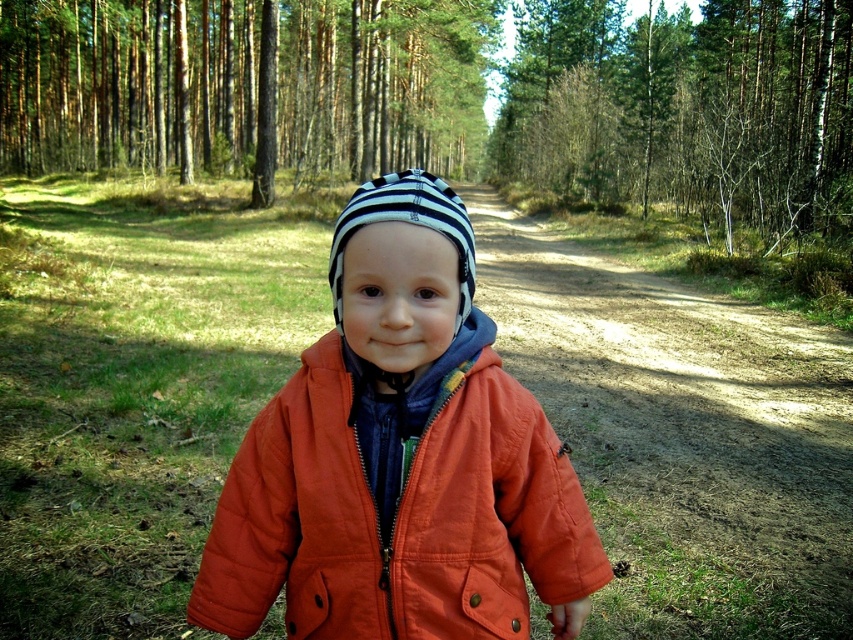
Question: Which point is closer to the camera taking this photo?

Choices:
 (A) (398, 356)
 (B) (550, 92)
 (C) (248, 132)

Answer: (A)

Question: Can you confirm if orange quilted jacket at center is positioned above smooth brown tree trunk at center?

Choices:
 (A) yes
 (B) no

Answer: (B)

Question: Which point is farther from the camera taking this photo?

Choices:
 (A) (317, 52)
 (B) (282, 500)

Answer: (A)

Question: Where is orange quilted jacket at center located in relation to green leafy tree at upper center in the image?

Choices:
 (A) left
 (B) right

Answer: (A)

Question: Can you confirm if orange quilted jacket at center is smaller than green leafy tree at upper center?

Choices:
 (A) no
 (B) yes

Answer: (B)

Question: Which of these objects is positioned closest to the orange quilted jacket at center?

Choices:
 (A) smooth brown tree trunk at center
 (B) green leafy tree at upper center

Answer: (B)